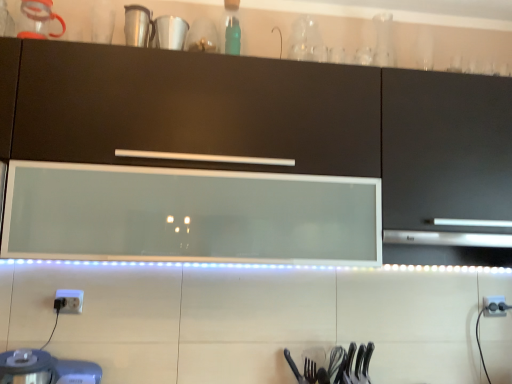
Question: Is white glossy cup at upper center outside of polished metal fork at lower center?

Choices:
 (A) yes
 (B) no

Answer: (A)

Question: Is the depth of white glossy cup at upper center less than that of polished metal fork at lower center?

Choices:
 (A) yes
 (B) no

Answer: (A)

Question: Is white glossy cup at upper center not close to polished metal fork at lower center?

Choices:
 (A) no
 (B) yes

Answer: (B)

Question: Is white glossy cup at upper center thinner than polished metal fork at lower center?

Choices:
 (A) no
 (B) yes

Answer: (A)

Question: Is white glossy cup at upper center oriented towards polished metal fork at lower center?

Choices:
 (A) no
 (B) yes

Answer: (A)

Question: From the image's perspective, is white glossy cup at upper center on polished metal fork at lower center?

Choices:
 (A) yes
 (B) no

Answer: (A)

Question: Considering the relative sizes of metallic silver blender at lower left and matte black cabinet at center in the image provided, is metallic silver blender at lower left taller than matte black cabinet at center?

Choices:
 (A) yes
 (B) no

Answer: (B)

Question: Considering the relative sizes of metallic silver blender at lower left and matte black cabinet at center in the image provided, is metallic silver blender at lower left shorter than matte black cabinet at center?

Choices:
 (A) no
 (B) yes

Answer: (B)

Question: Does metallic silver blender at lower left appear on the right side of matte black cabinet at center?

Choices:
 (A) yes
 (B) no

Answer: (B)

Question: From a real-world perspective, is metallic silver blender at lower left under matte black cabinet at center?

Choices:
 (A) yes
 (B) no

Answer: (A)

Question: Is metallic silver blender at lower left oriented towards matte black cabinet at center?

Choices:
 (A) yes
 (B) no

Answer: (B)

Question: From the image's perspective, does metallic silver blender at lower left appear lower than matte black cabinet at center?

Choices:
 (A) yes
 (B) no

Answer: (A)

Question: Considering the relative sizes of white plastic electric outlet at lower right, the first electric outlet in the bottom-to-top sequence, and polished metal fork at lower center in the image provided, is white plastic electric outlet at lower right, the first electric outlet in the bottom-to-top sequence, wider than polished metal fork at lower center?

Choices:
 (A) no
 (B) yes

Answer: (A)